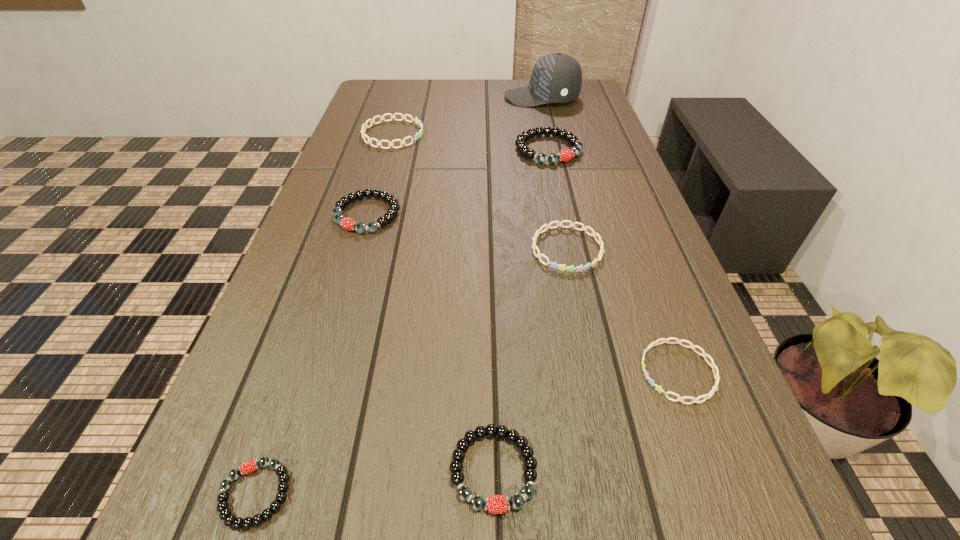
At what (x,y) coordinates should I click in order to perform the action: click on the farthest object. Please return your answer as a coordinate pair (x, y). The width and height of the screenshot is (960, 540). Looking at the image, I should click on click(556, 78).

Where is `baseball cap`? baseball cap is located at coordinates (556, 78).

In order to click on the second tallest object in this screenshot , I will do `click(565, 155)`.

The image size is (960, 540). I want to click on the rightmost black bracelet, so click(565, 155).

In order to click on the biggest blue bracelet in this screenshot , I will do `click(364, 126)`.

Where is `the farthest blue bracelet`? the farthest blue bracelet is located at coordinates (364, 126).

Find the location of a particular element. the second farthest black bracelet is located at coordinates (347, 223).

Find the location of a particular element. the second farthest blue bracelet is located at coordinates (561, 267).

The height and width of the screenshot is (540, 960). What are the coordinates of `the second biggest blue bracelet` in the screenshot? It's located at (561, 267).

Find the location of a particular element. The width and height of the screenshot is (960, 540). the fourth object from left to right is located at coordinates (497, 504).